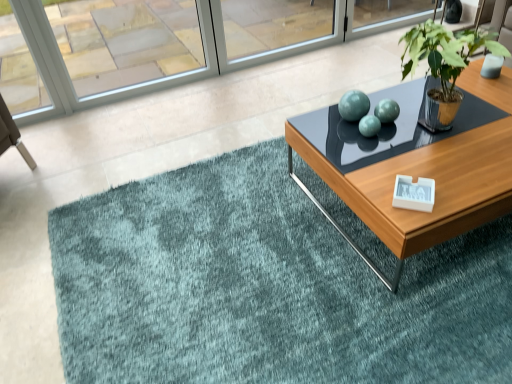
Question: Is green metallic plant pot at upper right with teal plush rug at center?

Choices:
 (A) no
 (B) yes

Answer: (A)

Question: Can you confirm if green metallic plant pot at upper right is thinner than teal plush rug at center?

Choices:
 (A) no
 (B) yes

Answer: (B)

Question: From a real-world perspective, is green metallic plant pot at upper right physically below teal plush rug at center?

Choices:
 (A) no
 (B) yes

Answer: (A)

Question: Does green metallic plant pot at upper right appear on the left side of teal plush rug at center?

Choices:
 (A) yes
 (B) no

Answer: (B)

Question: From a real-world perspective, is green metallic plant pot at upper right located higher than teal plush rug at center?

Choices:
 (A) no
 (B) yes

Answer: (B)

Question: Considering the positions of wooden glossy coffee table at center and green metallic plant pot at upper right in the image, is wooden glossy coffee table at center wider or thinner than green metallic plant pot at upper right?

Choices:
 (A) wide
 (B) thin

Answer: (A)

Question: Considering the positions of wooden glossy coffee table at center and green metallic plant pot at upper right in the image, is wooden glossy coffee table at center taller or shorter than green metallic plant pot at upper right?

Choices:
 (A) tall
 (B) short

Answer: (B)

Question: Looking at the image, does wooden glossy coffee table at center seem bigger or smaller compared to green metallic plant pot at upper right?

Choices:
 (A) small
 (B) big

Answer: (B)

Question: Does point (392, 211) appear closer or farther from the camera than point (451, 84)?

Choices:
 (A) closer
 (B) farther

Answer: (A)

Question: In the image, is clear glass window at upper left positioned in front of or behind teal plush rug at center?

Choices:
 (A) front
 (B) behind

Answer: (B)

Question: From the image's perspective, relative to teal plush rug at center, is clear glass window at upper left above or below?

Choices:
 (A) below
 (B) above

Answer: (B)

Question: Which is correct: clear glass window at upper left is inside teal plush rug at center, or outside of it?

Choices:
 (A) outside
 (B) inside

Answer: (A)

Question: From a real-world perspective, is clear glass window at upper left above or below teal plush rug at center?

Choices:
 (A) below
 (B) above

Answer: (B)

Question: Is teal plush rug at center taller or shorter than clear glass window at upper left?

Choices:
 (A) short
 (B) tall

Answer: (A)

Question: From a real-world perspective, is teal plush rug at center positioned above or below clear glass window at upper left?

Choices:
 (A) below
 (B) above

Answer: (A)